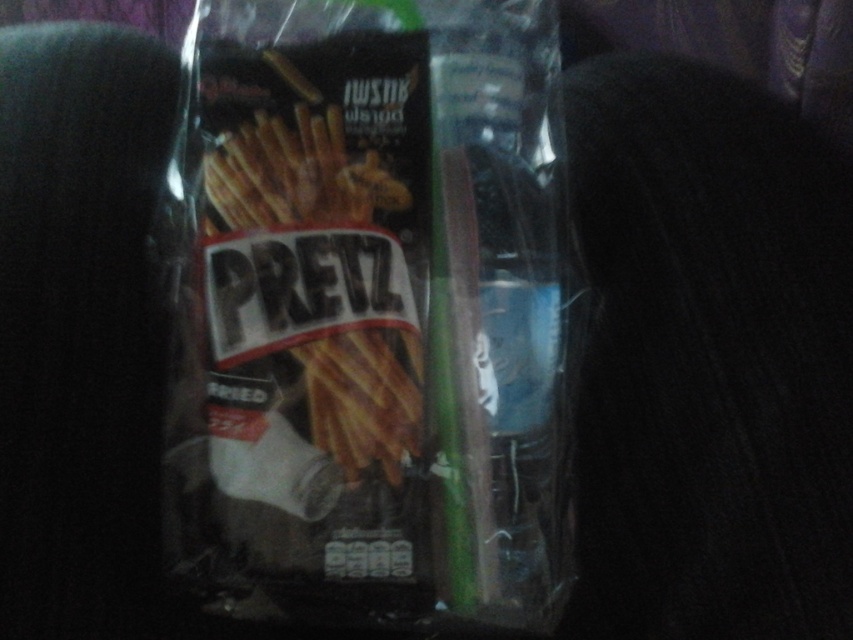
Question: Is matte plastic bag at center above matte brown french fries at center?

Choices:
 (A) yes
 (B) no

Answer: (B)

Question: Which point is closer to the camera taking this photo?

Choices:
 (A) (538, 467)
 (B) (274, 140)

Answer: (B)

Question: Which object appears farthest from the camera in this image?

Choices:
 (A) matte plastic bag at center
 (B) matte brown french fries at center

Answer: (B)

Question: Is matte plastic bag at center below matte brown french fries at center?

Choices:
 (A) yes
 (B) no

Answer: (A)

Question: Where is matte plastic bag at center located in relation to matte brown french fries at center in the image?

Choices:
 (A) below
 (B) above

Answer: (A)

Question: Among these objects, which one is farthest from the camera?

Choices:
 (A) matte plastic bag at center
 (B) matte brown french fries at center

Answer: (B)